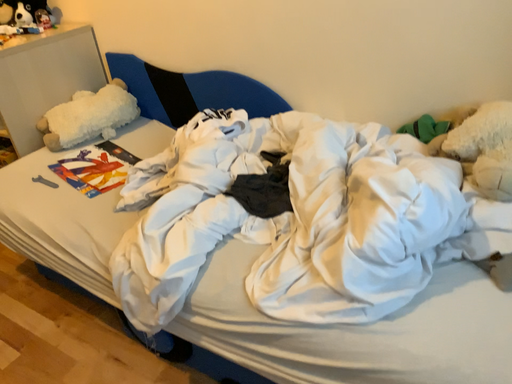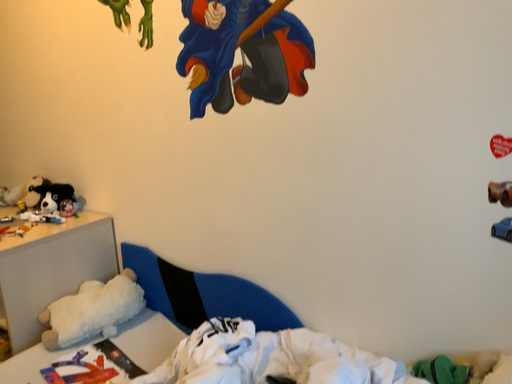
Question: How did the camera likely rotate when shooting the video?

Choices:
 (A) rotated upward
 (B) rotated downward

Answer: (A)